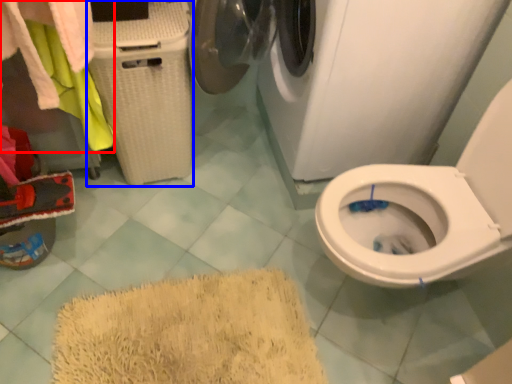
Question: Which point is closer to the camera, laundry (highlighted by a red box) or laundry basket (highlighted by a blue box)?

Choices:
 (A) laundry
 (B) laundry basket

Answer: (A)